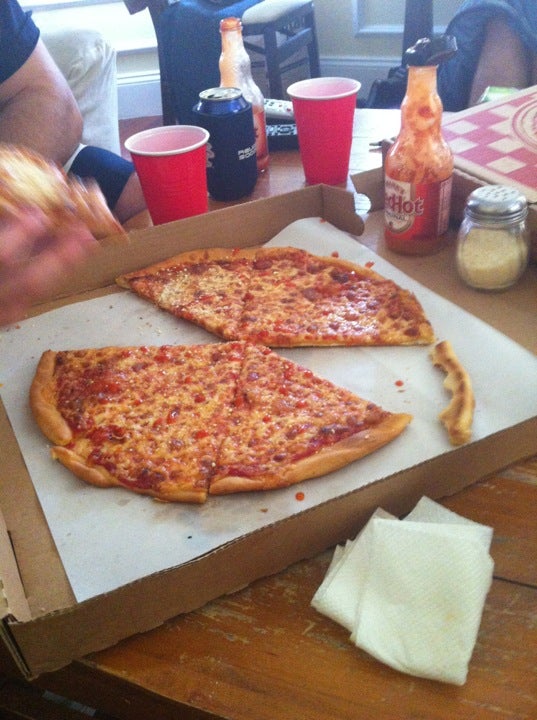
The height and width of the screenshot is (720, 537). Identify the location of napkin. (402, 564).